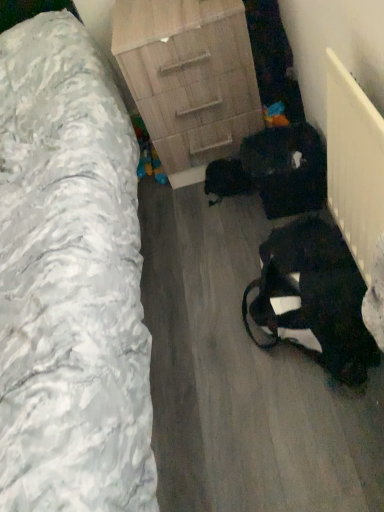
Question: Does black fabric bag at lower right have a smaller size compared to wooden chest of drawers at center?

Choices:
 (A) no
 (B) yes

Answer: (B)

Question: Could you tell me if black fabric bag at lower right is facing wooden chest of drawers at center?

Choices:
 (A) yes
 (B) no

Answer: (B)

Question: Would you say black fabric bag at lower right is a long distance from wooden chest of drawers at center?

Choices:
 (A) yes
 (B) no

Answer: (B)

Question: Is wooden chest of drawers at center at the back of black fabric bag at lower right?

Choices:
 (A) yes
 (B) no

Answer: (B)

Question: From the image's perspective, is black fabric bag at lower right above wooden chest of drawers at center?

Choices:
 (A) yes
 (B) no

Answer: (B)

Question: From a real-world perspective, is wooden nightstand at center physically located above or below black fabric bag at lower right?

Choices:
 (A) below
 (B) above

Answer: (B)

Question: Considering the positions of wooden nightstand at center and black fabric bag at lower right in the image, is wooden nightstand at center taller or shorter than black fabric bag at lower right?

Choices:
 (A) tall
 (B) short

Answer: (A)

Question: Considering the positions of wooden nightstand at center and black fabric bag at lower right in the image, is wooden nightstand at center bigger or smaller than black fabric bag at lower right?

Choices:
 (A) big
 (B) small

Answer: (A)

Question: From the image's perspective, is wooden nightstand at center located above or below black fabric bag at lower right?

Choices:
 (A) below
 (B) above

Answer: (B)

Question: From a real-world perspective, is wooden chest of drawers at center positioned above or below black fabric bag at lower right?

Choices:
 (A) below
 (B) above

Answer: (B)

Question: Based on their sizes in the image, would you say wooden chest of drawers at center is bigger or smaller than black fabric bag at lower right?

Choices:
 (A) small
 (B) big

Answer: (B)

Question: Is point (235, 120) closer or farther from the camera than point (309, 263)?

Choices:
 (A) closer
 (B) farther

Answer: (B)

Question: Based on their positions, is wooden chest of drawers at center located to the left or right of black fabric bag at lower right?

Choices:
 (A) right
 (B) left

Answer: (B)

Question: From the image's perspective, is wooden nightstand at center above or below wooden chest of drawers at center?

Choices:
 (A) above
 (B) below

Answer: (B)

Question: Is wooden nightstand at center inside the boundaries of wooden chest of drawers at center, or outside?

Choices:
 (A) inside
 (B) outside

Answer: (B)